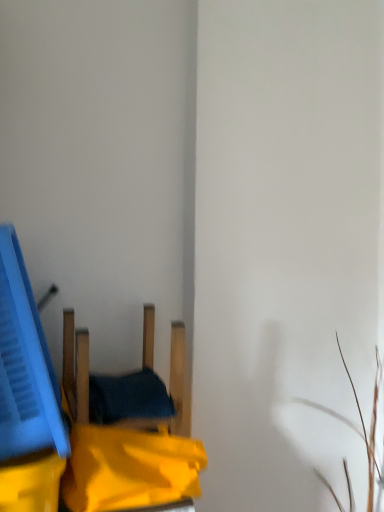
Question: Is blue plastic crate at left taller or shorter than wooden chair at center?

Choices:
 (A) tall
 (B) short

Answer: (A)

Question: From the image's perspective, is blue plastic crate at left located above or below wooden chair at center?

Choices:
 (A) above
 (B) below

Answer: (A)

Question: Does point (9, 226) appear closer or farther from the camera than point (178, 345)?

Choices:
 (A) closer
 (B) farther

Answer: (A)

Question: Would you say wooden chair at center is to the left or to the right of blue plastic crate at left in the picture?

Choices:
 (A) left
 (B) right

Answer: (B)

Question: Do you think wooden chair at center is within blue plastic crate at left, or outside of it?

Choices:
 (A) inside
 (B) outside

Answer: (B)

Question: In terms of size, does wooden chair at center appear bigger or smaller than blue plastic crate at left?

Choices:
 (A) big
 (B) small

Answer: (B)

Question: Is wooden chair at center in front of or behind blue plastic crate at left in the image?

Choices:
 (A) front
 (B) behind

Answer: (B)